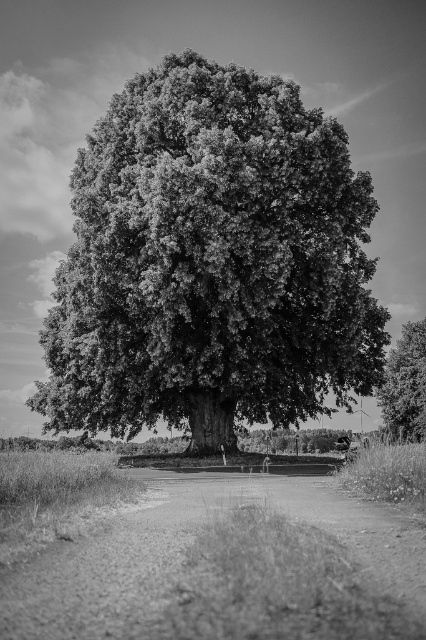
Question: Does smooth bark oak tree at center have a lesser width compared to dark green textured tree at right?

Choices:
 (A) no
 (B) yes

Answer: (A)

Question: Considering the relative positions of smooth bark oak tree at center and dark green textured tree at right in the image provided, where is smooth bark oak tree at center located with respect to dark green textured tree at right?

Choices:
 (A) below
 (B) above

Answer: (B)

Question: Which point is closer to the camera taking this photo?

Choices:
 (A) (420, 364)
 (B) (186, 378)

Answer: (B)

Question: Is smooth bark oak tree at center smaller than dark green textured tree at right?

Choices:
 (A) no
 (B) yes

Answer: (A)